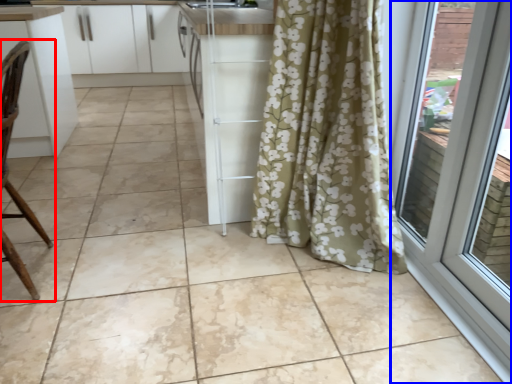
Question: Which object appears closest to the camera in this image, chair (highlighted by a red box) or door (highlighted by a blue box)?

Choices:
 (A) chair
 (B) door

Answer: (B)